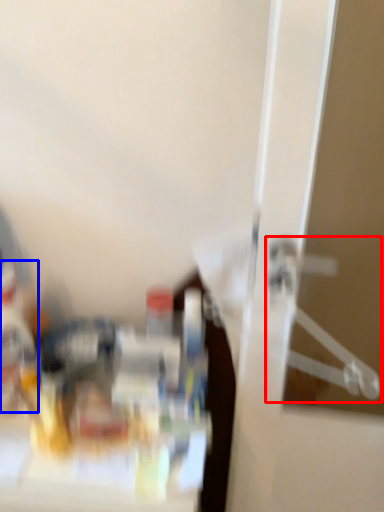
Question: Which point is further to the camera, hanger (highlighted by a red box) or bottle (highlighted by a blue box)?

Choices:
 (A) hanger
 (B) bottle

Answer: (B)